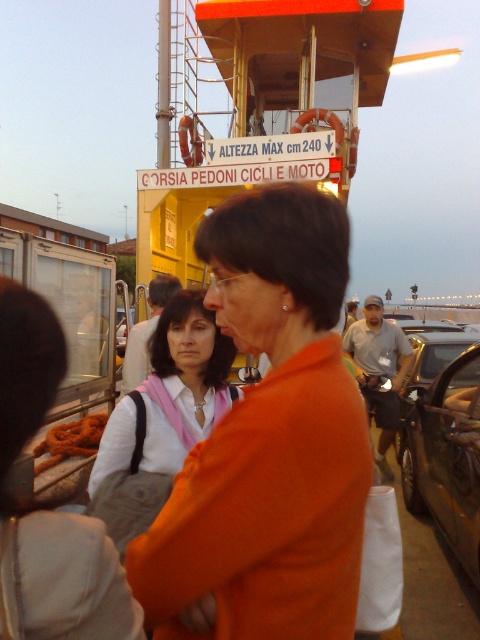
Question: Which of the following is the farthest from the observer?

Choices:
 (A) (130, 483)
 (B) (299, 212)

Answer: (A)

Question: Which of these objects is positioned farthest from the yellow matte ferry at upper center?

Choices:
 (A) shiny black car at center right
 (B) shiny black car at lower right
 (C) white fabric at center

Answer: (A)

Question: From the image, what is the correct spatial relationship of yellow matte ferry at upper center in relation to shiny black car at center right?

Choices:
 (A) right
 (B) left

Answer: (B)

Question: Does orange fabric bag at center have a larger size compared to shiny black car at center right?

Choices:
 (A) yes
 (B) no

Answer: (B)

Question: Which point is closer to the camera?

Choices:
 (A) shiny black car at center right
 (B) orange fabric bag at center
 (C) shiny black car at lower right
 (D) white fabric at center

Answer: (B)

Question: Does yellow matte ferry at upper center appear over white fabric at center?

Choices:
 (A) yes
 (B) no

Answer: (A)